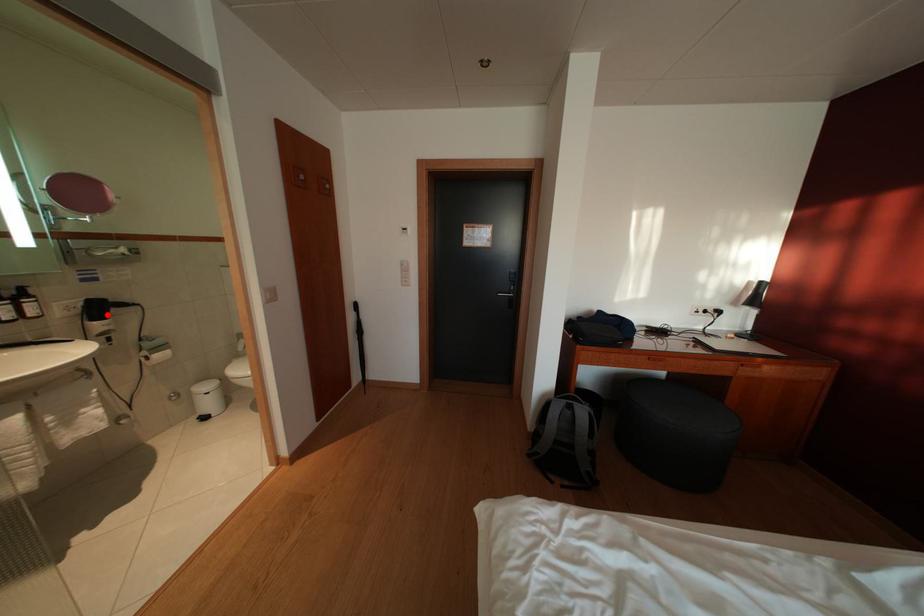
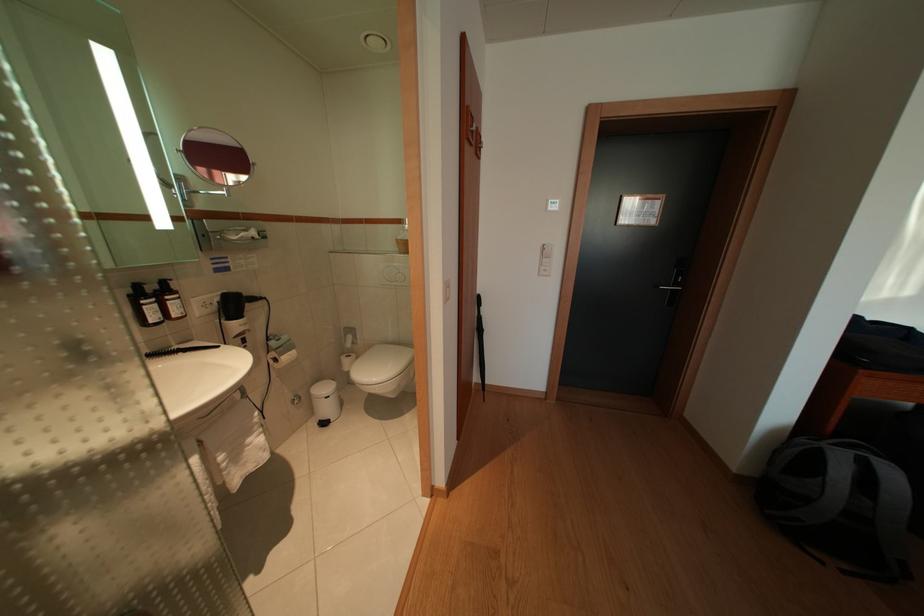
The point at the highlighted location is marked in the first image. Where is the corresponding point in the second image?

(242, 310)